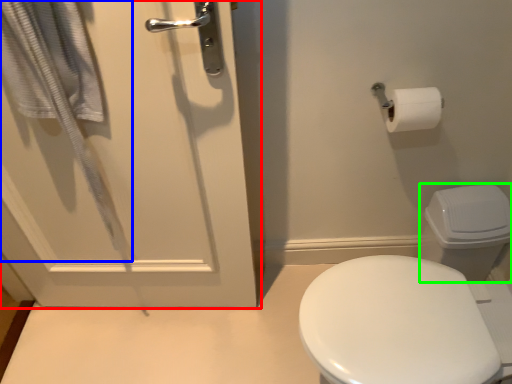
Question: Estimate the real-world distances between objects in this image. Which object is closer to door (highlighted by a red box), bath towel (highlighted by a blue box) or toilet bowl (highlighted by a green box)?

Choices:
 (A) bath towel
 (B) toilet bowl

Answer: (A)